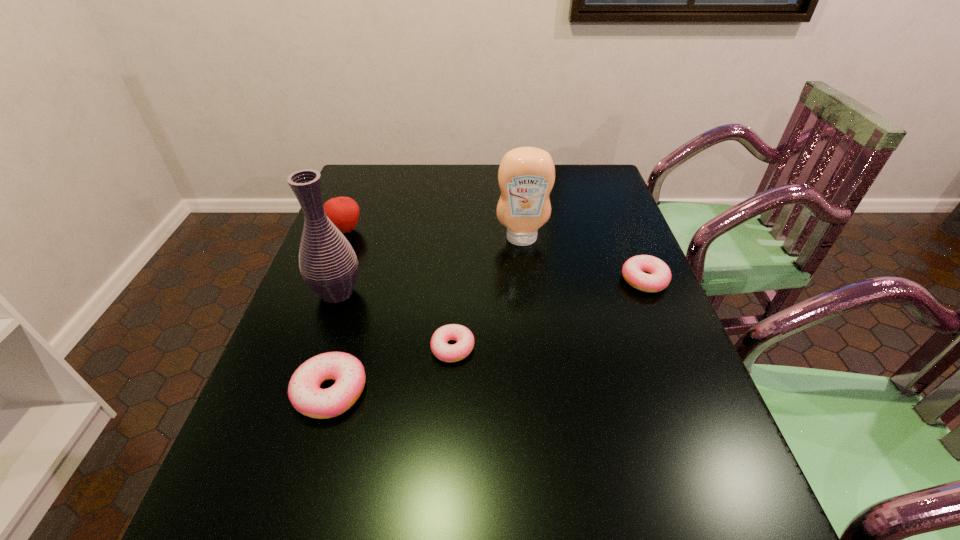
Identify the location of free space between the vase and the leftmost doughnut. (334, 342).

In order to click on vacant point located between the third tallest object and the farthest doughnut in this screenshot , I will do `click(495, 255)`.

The width and height of the screenshot is (960, 540). I want to click on free space that is in between the third tallest object and the shortest object, so click(x=399, y=289).

Locate an element on the screen. The width and height of the screenshot is (960, 540). free space that is in between the apple and the fifth shortest object is located at coordinates (434, 234).

You are a GUI agent. You are given a task and a screenshot of the screen. Output one action in this format:
    pyautogui.click(x=<x>, y=<y>)
    Task: Click on the object that is the third closest to the apple
    This screenshot has height=540, width=960.
    Given the screenshot: What is the action you would take?
    [462, 335]

You are a GUI agent. You are given a task and a screenshot of the screen. Output one action in this format:
    pyautogui.click(x=<x>, y=<y>)
    Task: Click on the object identified as the fourth closest to the second tallest object
    This screenshot has height=540, width=960.
    Given the screenshot: What is the action you would take?
    pyautogui.click(x=343, y=211)

In order to click on doughnut that is the nearest to the tallest doughnut in this screenshot , I will do `click(462, 335)`.

This screenshot has width=960, height=540. Find the location of `doughnut that stands as the second closest to the second doughnut from right to left`. doughnut that stands as the second closest to the second doughnut from right to left is located at coordinates (659, 277).

You are a GUI agent. You are given a task and a screenshot of the screen. Output one action in this format:
    pyautogui.click(x=<x>, y=<y>)
    Task: Click on the vacant space that satisfies the following two spatial constraints: 1. on the back side of the second doughnut from left to right; 2. on the right side of the leftmost doughnut
    
    Given the screenshot: What is the action you would take?
    pyautogui.click(x=343, y=348)

The width and height of the screenshot is (960, 540). In order to click on vacant space that satisfies the following two spatial constraints: 1. on the front side of the vase; 2. on the right side of the tallest doughnut in this screenshot , I will do `click(303, 392)`.